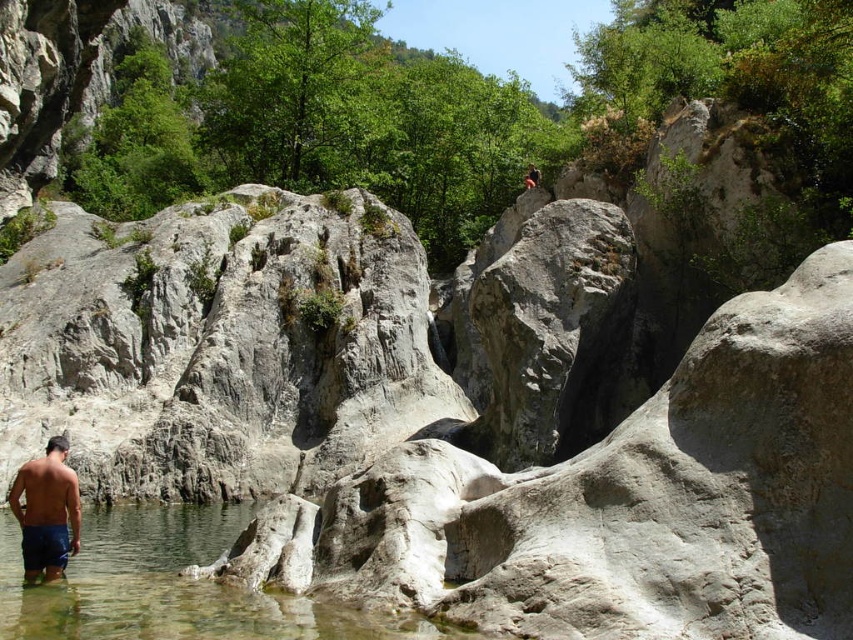
Can you confirm if clear water at lower left is thinner than blue denim shorts at lower left?

Incorrect, clear water at lower left's width is not less than blue denim shorts at lower left's.

Where is `clear water at lower left`? The image size is (853, 640). clear water at lower left is located at coordinates click(x=171, y=586).

Find the location of `clear water at lower left`. clear water at lower left is located at coordinates (171, 586).